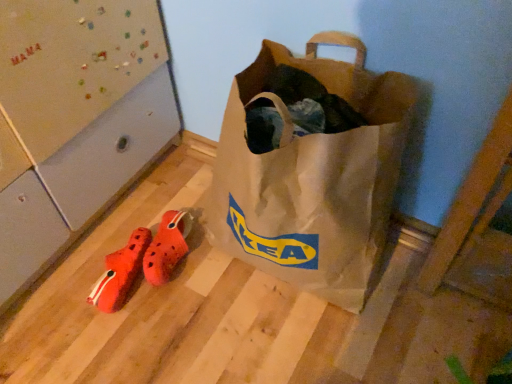
I want to click on space that is in front of orange fabric shoe at lower left, so click(113, 343).